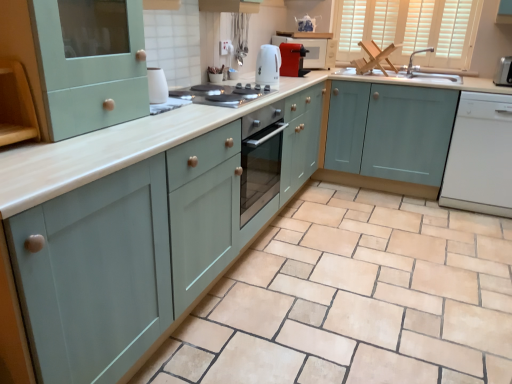
The width and height of the screenshot is (512, 384). I want to click on free location in front of white glossy paper towel holder at upper center, which is counted as the fourth appliance, starting from the right, so click(x=161, y=112).